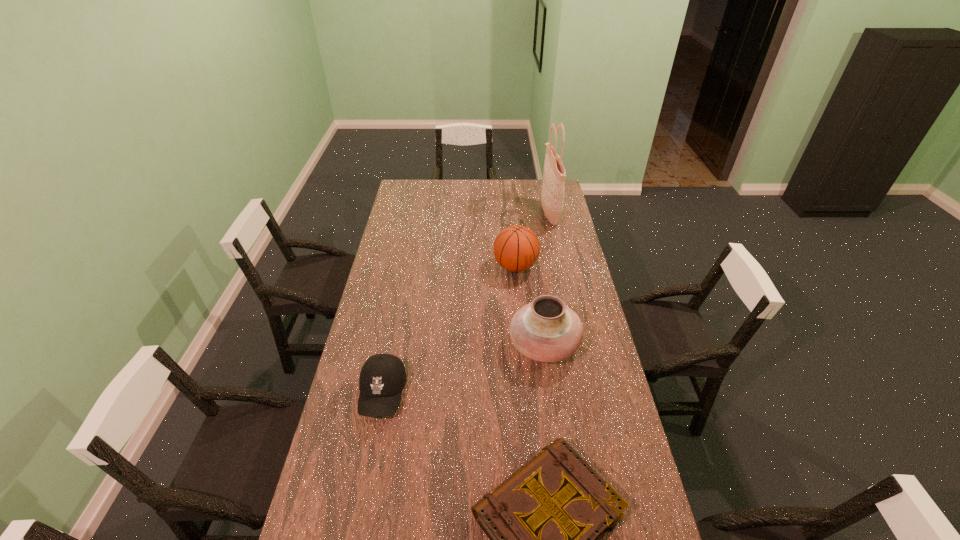
At what (x,y) coordinates should I click in order to perform the action: click on the farthest object. Please return your answer as a coordinate pair (x, y). Looking at the image, I should click on coord(552,197).

I want to click on shopping bag, so click(552, 197).

Locate an element on the screen. The height and width of the screenshot is (540, 960). the second farthest object is located at coordinates tap(516, 248).

Locate an element on the screen. The width and height of the screenshot is (960, 540). pottery is located at coordinates (546, 330).

Locate an element on the screen. the second shortest object is located at coordinates (382, 378).

Locate an element on the screen. baseball cap is located at coordinates (382, 378).

Where is `vacant space positioned on the left of the farthest object`? This screenshot has height=540, width=960. vacant space positioned on the left of the farthest object is located at coordinates (503, 214).

This screenshot has height=540, width=960. I want to click on vacant space located on the back of the fourth nearest object, so click(510, 211).

This screenshot has height=540, width=960. What are the coordinates of `vacant space located 0.070m on the left of the pottery` in the screenshot? It's located at (490, 345).

This screenshot has width=960, height=540. I want to click on free space located on the front-facing side of the baseball cap, so click(x=366, y=481).